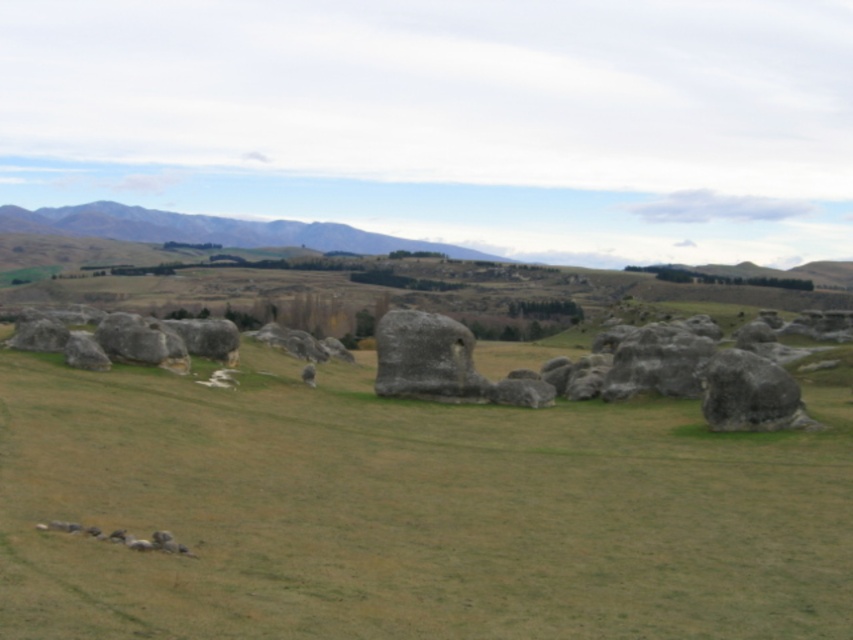
You are standing in the middle of the field and see two points marked on the ground. One is labeled as point (306, 240) and the other as point (135, 356). Which point is closer to you?

Point (306, 240) is further to the camera than point (135, 356), so the point closer to you is point (135, 356).